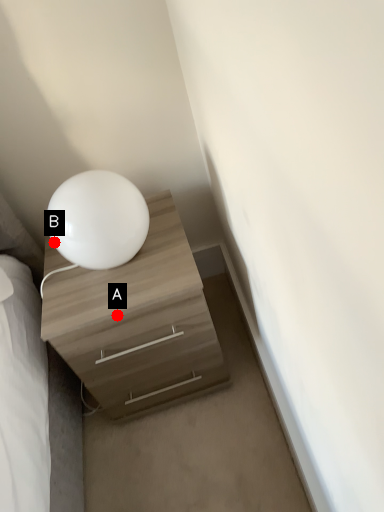
Question: Two points are circled on the image, labeled by A and B beside each circle. Which point appears closest to the camera in this image?

Choices:
 (A) A is closer
 (B) B is closer

Answer: (A)